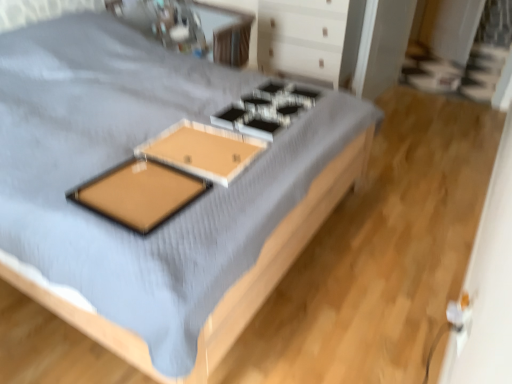
Question: From their relative heights in the image, would you say brown matte board at center is taller or shorter than white glossy drawer at upper center?

Choices:
 (A) short
 (B) tall

Answer: (A)

Question: Is point (170, 195) closer or farther from the camera than point (325, 21)?

Choices:
 (A) farther
 (B) closer

Answer: (B)

Question: Which is farther from the white glossy drawer at upper center?

Choices:
 (A) metallic silver gas stove at center
 (B) wooden tray at upper center, the second table when ordered from front to back
 (C) brown matte board at center
 (D) wooden bed at center
 (E) wooden tray at center, the first table in the front-to-back sequence

Answer: (C)

Question: Considering the real-world distances, which object is closest to the wooden tray at center, the first table in the front-to-back sequence?

Choices:
 (A) wooden bed at center
 (B) white glossy drawer at upper center
 (C) metallic silver gas stove at center
 (D) wooden tray at upper center, positioned as the second table in bottom-to-top order
 (E) brown matte board at center

Answer: (E)